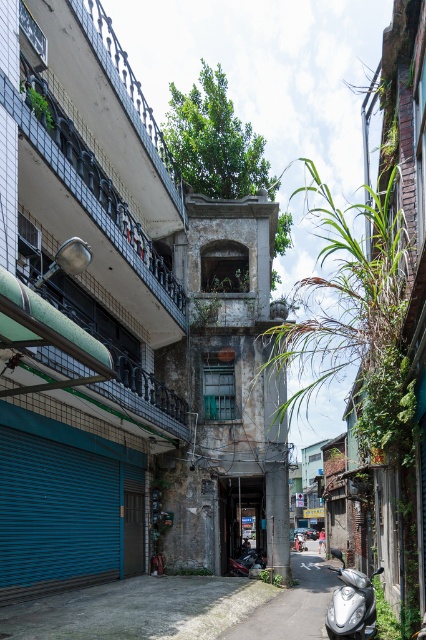
Question: Does blue metallic garage door at lower left have a lesser width compared to silver metallic scooter at lower right?

Choices:
 (A) yes
 (B) no

Answer: (A)

Question: Which point is farther from the camera taking this photo?

Choices:
 (A) (69, 452)
 (B) (334, 605)

Answer: (A)

Question: Considering the relative positions of blue metallic garage door at lower left and silver metallic scooter at lower right in the image provided, where is blue metallic garage door at lower left located with respect to silver metallic scooter at lower right?

Choices:
 (A) left
 (B) right

Answer: (A)

Question: Which point is closer to the camera?

Choices:
 (A) (71, 499)
 (B) (340, 634)

Answer: (B)

Question: Where is blue metallic garage door at lower left located in relation to silver metallic scooter at lower right in the image?

Choices:
 (A) right
 (B) left

Answer: (B)